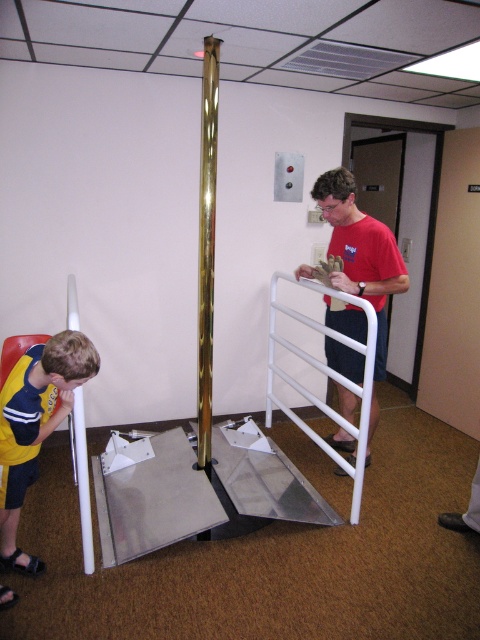
You are standing in the office and want to reach the point marked as point [396,272]. The pole is in the center. Can you walk straight towards it without moving around the pole?

The point marked as point [396,272] is 2.81 meters from the viewer. Since the pole is in the center, you can walk straight towards it without needing to go around the pole as the distance is manageable and the path is clear.